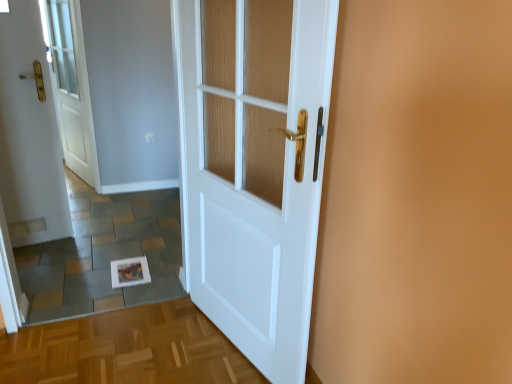
Question: Considering the positions of white glossy door at left, the first door viewed from the left, and white wood door at center, which appears as the 2th door when viewed from the back, in the image, is white glossy door at left, the first door viewed from the left, wider or thinner than white wood door at center, which appears as the 2th door when viewed from the back,?

Choices:
 (A) thin
 (B) wide

Answer: (A)

Question: Is white glossy door at left, arranged as the second door when viewed from the front, inside the boundaries of white wood door at center, which appears as the 2th door when viewed from the back, or outside?

Choices:
 (A) outside
 (B) inside

Answer: (A)

Question: Considering the relative positions of white glossy door at left, arranged as the 1th door when viewed from the back, and white wood door at center, the second door viewed from the left, in the image provided, is white glossy door at left, arranged as the 1th door when viewed from the back, to the left or to the right of white wood door at center, the second door viewed from the left,?

Choices:
 (A) left
 (B) right

Answer: (A)

Question: Is point (290, 271) positioned closer to the camera than point (35, 182)?

Choices:
 (A) farther
 (B) closer

Answer: (B)

Question: Is white wood door at center, the second door viewed from the left, inside the boundaries of white glossy door at left, the second door in the right-to-left sequence, or outside?

Choices:
 (A) inside
 (B) outside

Answer: (B)

Question: In terms of size, does white wood door at center, which appears as the 2th door when viewed from the back, appear bigger or smaller than white glossy door at left, the first door viewed from the left?

Choices:
 (A) small
 (B) big

Answer: (B)

Question: Is white wood door at center, which appears as the 2th door when viewed from the back, taller or shorter than white glossy door at left, arranged as the second door when viewed from the front?

Choices:
 (A) short
 (B) tall

Answer: (A)